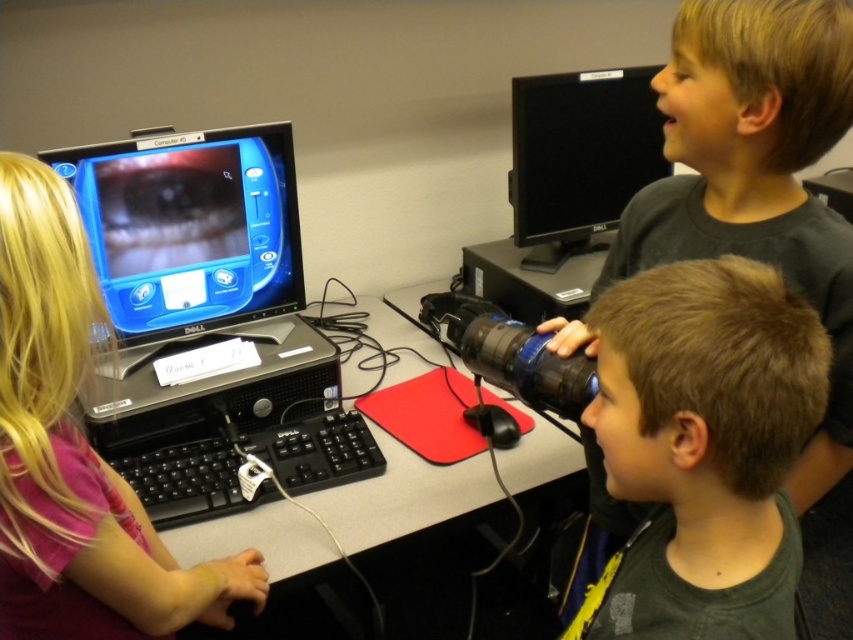
Question: Which of these objects is positioned closest to the smooth black desk at center?

Choices:
 (A) black glossy monitor at left
 (B) black glossy monitor at upper center

Answer: (A)

Question: Is black glossy monitor at upper center positioned behind smooth black desk at center?

Choices:
 (A) no
 (B) yes

Answer: (B)

Question: Which of the following is the farthest from the observer?

Choices:
 (A) (44, 515)
 (B) (815, 54)
 (C) (146, 259)

Answer: (C)

Question: Among these objects, which one is nearest to the camera?

Choices:
 (A) matte black binoculars at center
 (B) pink fabric shirt at left
 (C) smooth black desk at center
 (D) black glossy monitor at upper center

Answer: (B)

Question: Is brown matte hair at center to the left of smooth black desk at center from the viewer's perspective?

Choices:
 (A) yes
 (B) no

Answer: (B)

Question: In this image, where is brown matte hair at center located relative to black glossy monitor at upper center?

Choices:
 (A) right
 (B) left

Answer: (B)